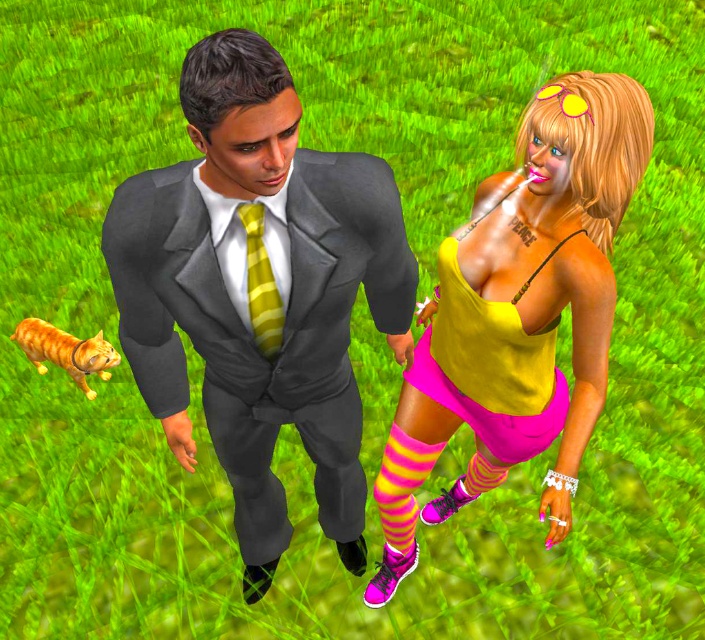
You are a fashion designer observing two models on a runway. You need to decide which outfit to feature in the next collection. The matte gray suit at center and the yellow matte tank top at center are both in the spotlight. Based on their visual prominence in the image, which one do you think is more eye catching due to its height?

The yellow matte tank top at center is taller than the matte gray suit at center, making it more eye catching due to its height.

You are a fashion designer analyzing the image. You need to place a new accessory exactly at the coordinates where the matte yellow tank top at center is located. What are the coordinates where you should place the accessory?

The coordinates where the matte yellow tank top at center is located are at point (491, 364), so you should place the accessory there.

In the scene shown: You are a tailor measuring the distance between the matte gray suit at center and the yellow striped tie at center for a custom fit. The minimum required distance for proper tailoring is 15 inches. Is the current distance sufficient?

The distance between the matte gray suit at center and the yellow striped tie at center is 14.90 inches, which is just below the required 15 inches. Therefore, the current distance is insufficient for proper tailoring.